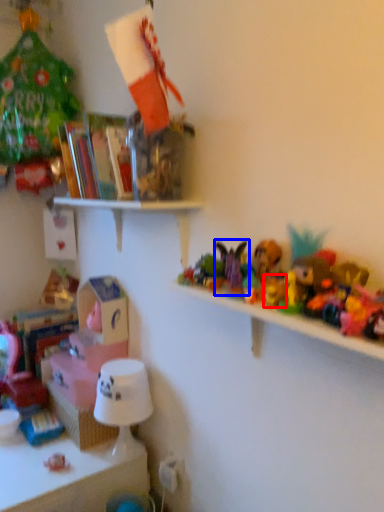
Question: Among these objects, which one is farthest to the camera, toy (highlighted by a red box) or toy (highlighted by a blue box)?

Choices:
 (A) toy
 (B) toy

Answer: (B)